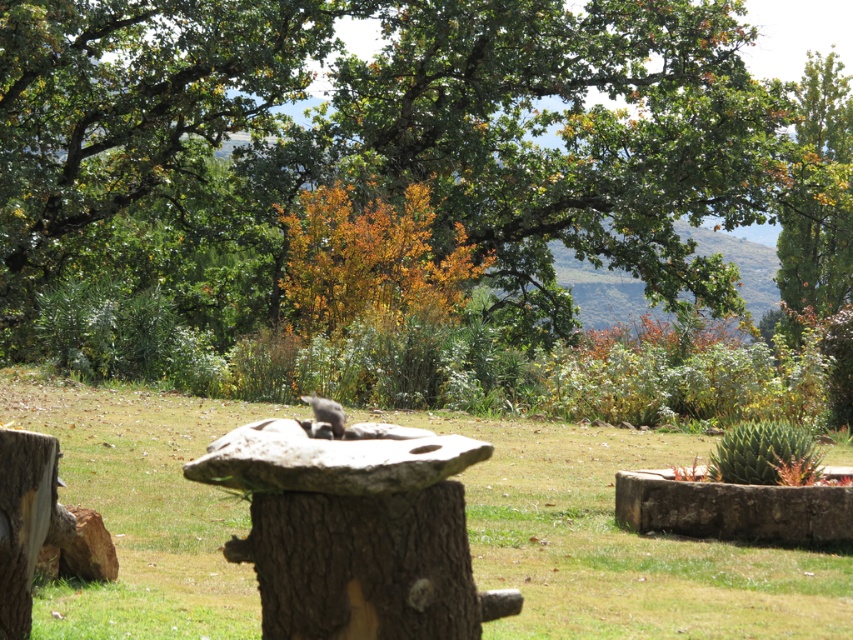
You are a photographer setting up a shot in the garden. You have a camera with a 10cm wide lens. The smooth stone stump at center and the fuzzy gray cat at center are both in your frame. Can the lens capture both objects without moving the camera?

The smooth stone stump at center occupies less space than the fuzzy gray cat at center, so the lens can capture both objects as the cat takes up more space and the stump is smaller, fitting within the 10cm width.